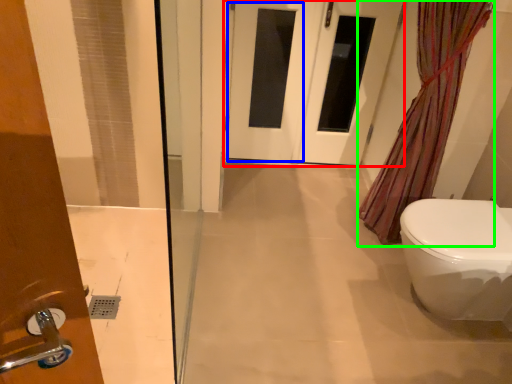
Question: Which is farther away from door (highlighted by a red box)? screen door (highlighted by a blue box) or shower curtain (highlighted by a green box)?

Choices:
 (A) screen door
 (B) shower curtain

Answer: (B)